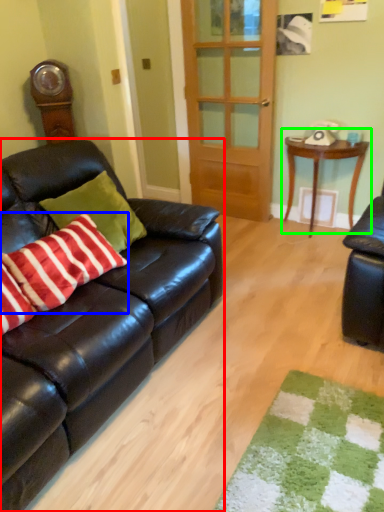
Question: Which object is the closest to the studio couch (highlighted by a red box)? Choose among these: pillow (highlighted by a blue box) or table (highlighted by a green box).

Choices:
 (A) pillow
 (B) table

Answer: (A)